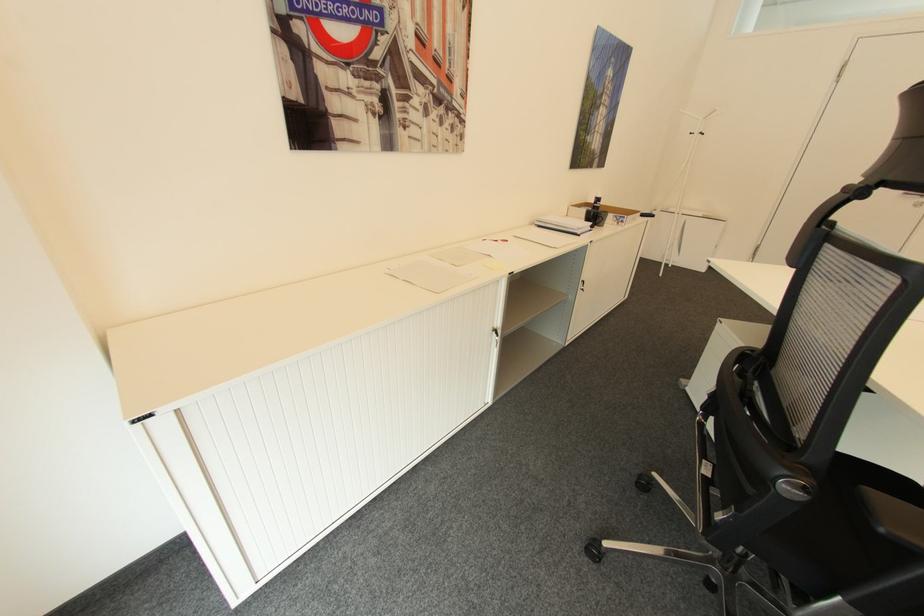
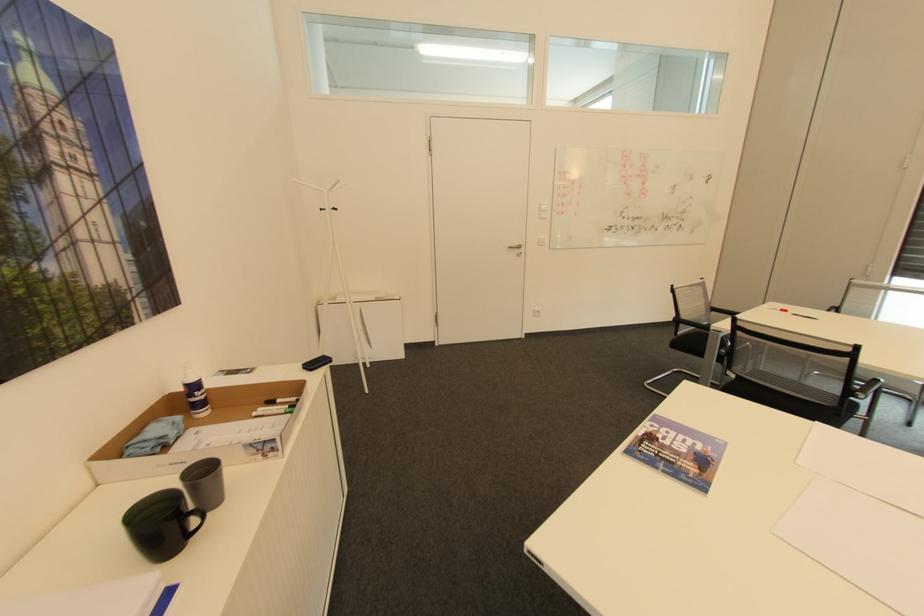
The point at (700, 132) is marked in the first image. Where is the corresponding point in the second image?

(333, 208)